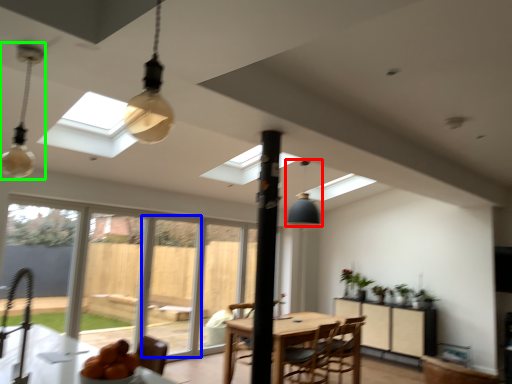
Question: Which is farther away from light fixture (highlighted by a red box)? screen door (highlighted by a blue box) or lamp (highlighted by a green box)?

Choices:
 (A) screen door
 (B) lamp

Answer: (B)